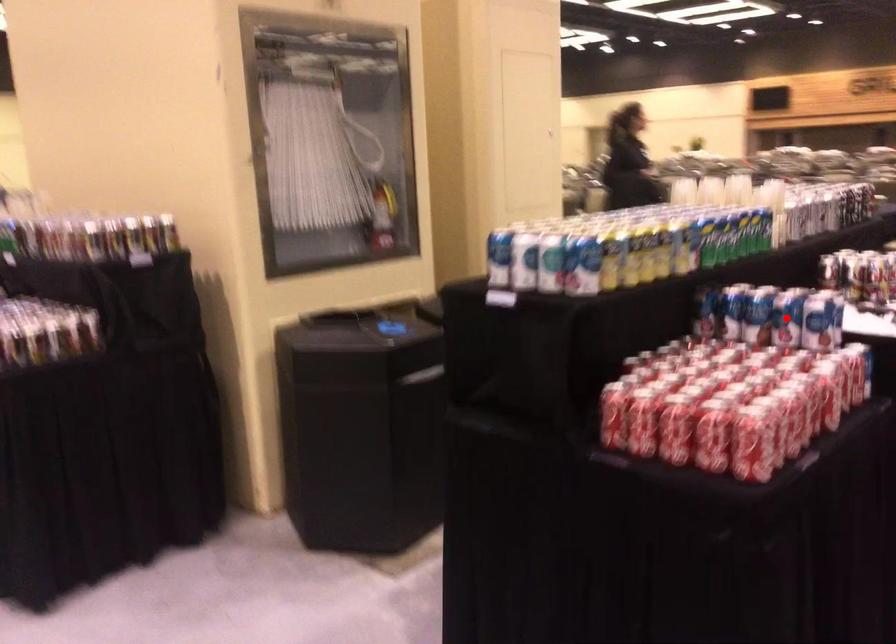
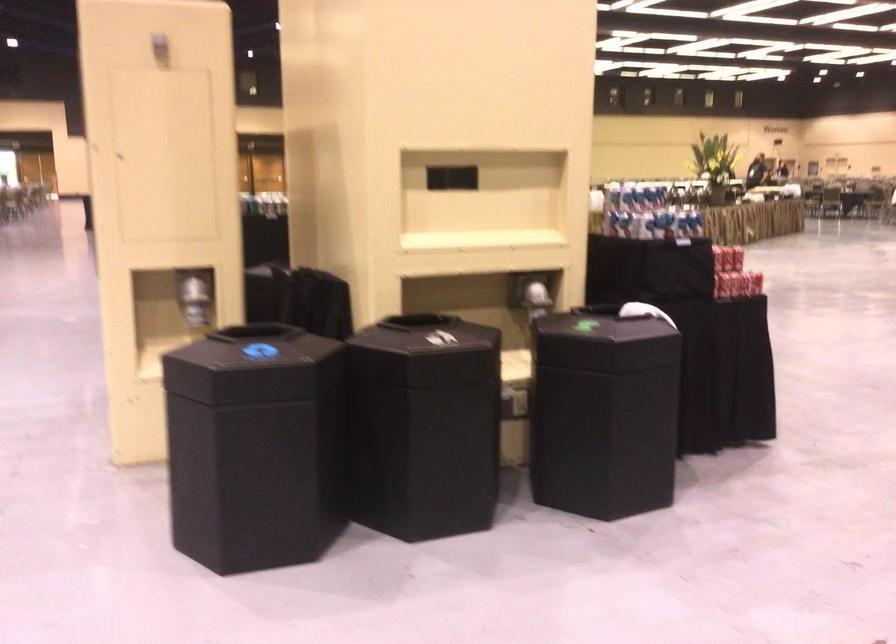
Question: I am providing you with two images of the same scene from different viewpoints. A red point is marked on the first image. Can you still see the location of the red point in image 2?

Choices:
 (A) Yes
 (B) No

Answer: (B)